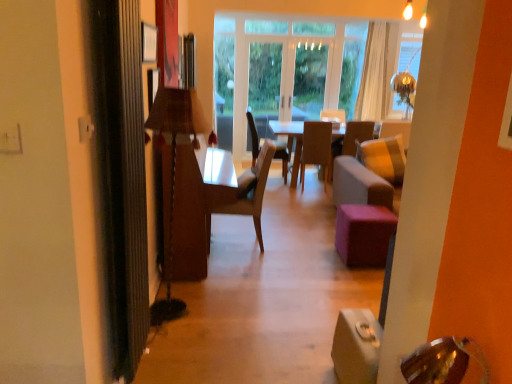
Locate an element on the screen. Image resolution: width=512 pixels, height=384 pixels. empty space that is to the right of light brown wood chair at center, placed as the third chair when sorted from right to left is located at coordinates (292, 242).